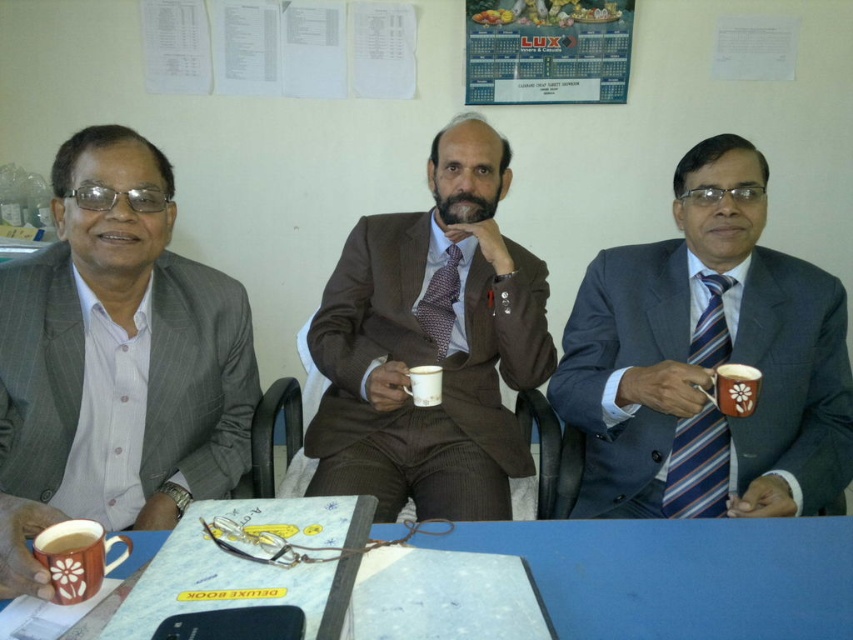
Is wooden table at center shorter than matte ceramic mug at lower left?

No, wooden table at center is not shorter than matte ceramic mug at lower left.

Is point (732, 632) positioned after point (93, 541)?

Yes, point (732, 632) is behind point (93, 541).

You are a GUI agent. You are given a task and a screenshot of the screen. Output one action in this format:
    pyautogui.click(x=<x>, y=<y>)
    Task: Click on the wooden table at center
    This screenshot has height=640, width=853.
    Given the screenshot: What is the action you would take?
    pyautogui.click(x=682, y=576)

Which is above, blue striped tie at center or matte ceramic mug at lower left?

blue striped tie at center

Based on the photo, is blue striped tie at center smaller than matte ceramic mug at lower left?

Actually, blue striped tie at center might be larger than matte ceramic mug at lower left.

Between point (624, 259) and point (61, 532), which one is positioned behind?

Point (624, 259)

Identify the location of blue striped tie at center. This screenshot has width=853, height=640. (706, 362).

In the scene shown: Does wooden table at center have a greater height compared to striped fabric tie at right?

In fact, wooden table at center may be shorter than striped fabric tie at right.

Identify the location of wooden table at center. (682, 576).

Locate an element on the screen. wooden table at center is located at coordinates (682, 576).

The height and width of the screenshot is (640, 853). In order to click on wooden table at center in this screenshot , I will do `click(682, 576)`.